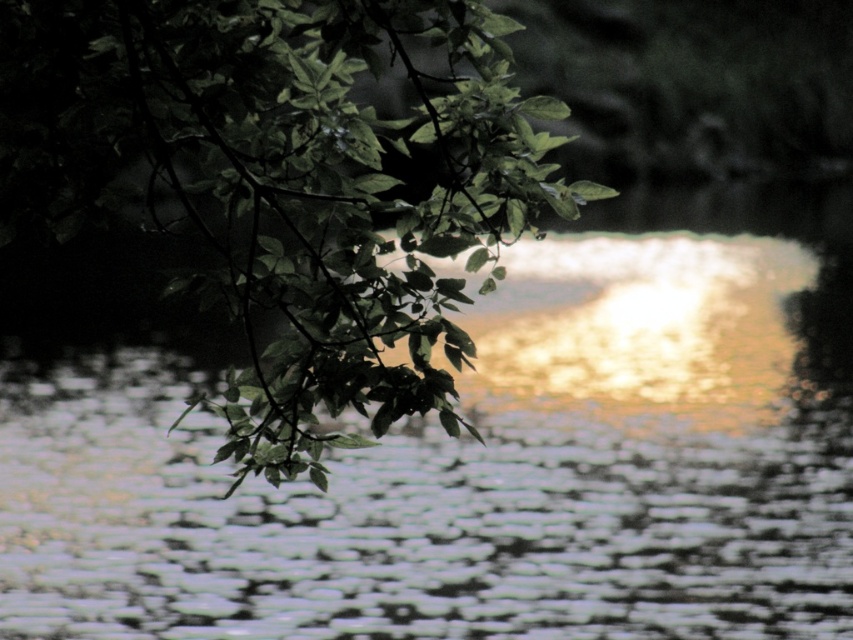
Question: Among these points, which one is nearest to the camera?

Choices:
 (A) (282, 586)
 (B) (154, 1)

Answer: (B)

Question: From the image, what is the correct spatial relationship of glistening water at center in relation to green leafy branch at upper left?

Choices:
 (A) below
 (B) above

Answer: (A)

Question: Which object appears closest to the camera in this image?

Choices:
 (A) glistening water at center
 (B) green leafy branch at upper left

Answer: (B)

Question: Is glistening water at center bigger than green leafy branch at upper left?

Choices:
 (A) yes
 (B) no

Answer: (B)

Question: Observing the image, what is the correct spatial positioning of glistening water at center in reference to green leafy branch at upper left?

Choices:
 (A) left
 (B) right

Answer: (A)